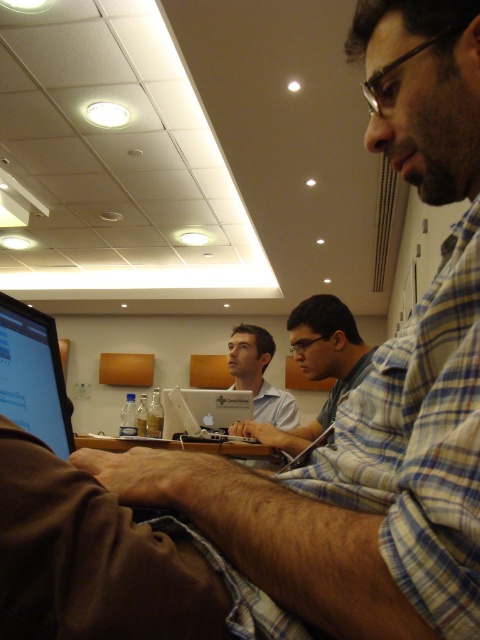
Question: Which object is closer to the camera taking this photo?

Choices:
 (A) matte white laptop at center
 (B) light blue shirt at center
 (C) matte black laptop at left
 (D) silver metallic laptop at center

Answer: (C)

Question: Is matte white laptop at center to the left of silver metallic laptop at center from the viewer's perspective?

Choices:
 (A) yes
 (B) no

Answer: (B)

Question: Considering the real-world distances, which object is closest to the matte black laptop at left?

Choices:
 (A) light blue shirt at center
 (B) matte white laptop at center
 (C) silver metallic laptop at center

Answer: (A)

Question: Is matte white laptop at center positioned behind silver metallic laptop at center?

Choices:
 (A) no
 (B) yes

Answer: (B)

Question: Which of the following is the farthest from the observer?

Choices:
 (A) (225, 428)
 (B) (268, 436)
 (C) (31, 394)
 (D) (252, 352)

Answer: (D)

Question: Does matte black laptop at left appear over silver metallic laptop at center?

Choices:
 (A) yes
 (B) no

Answer: (A)